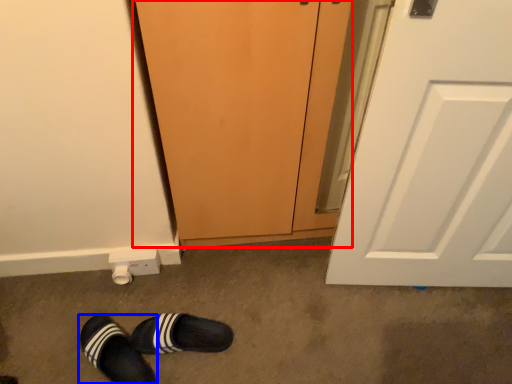
Question: Among these objects, which one is nearest to the camera, screen door (highlighted by a red box) or footwear (highlighted by a blue box)?

Choices:
 (A) screen door
 (B) footwear

Answer: (A)